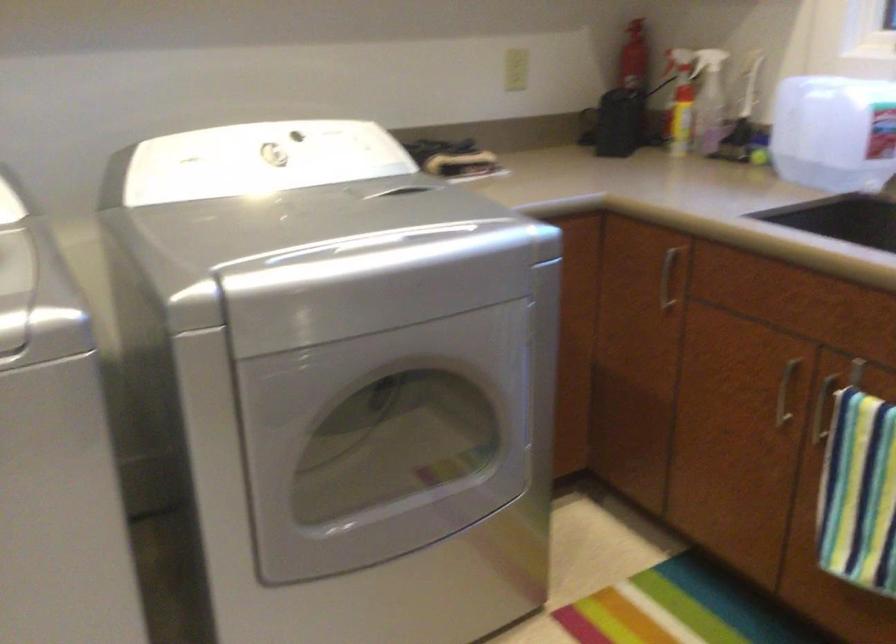
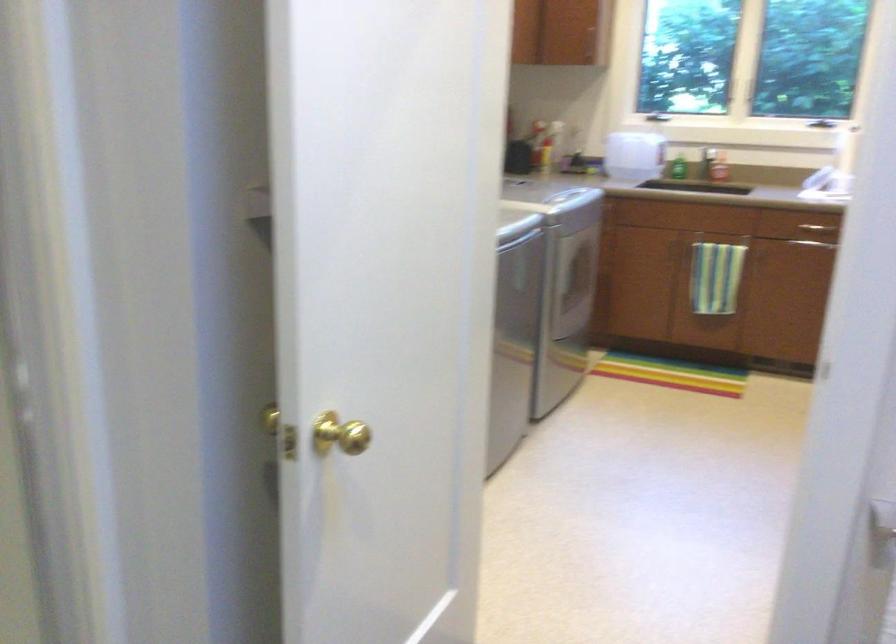
Locate, in the second image, the point that corresponds to the point at 803,149 in the first image.

(633, 155)